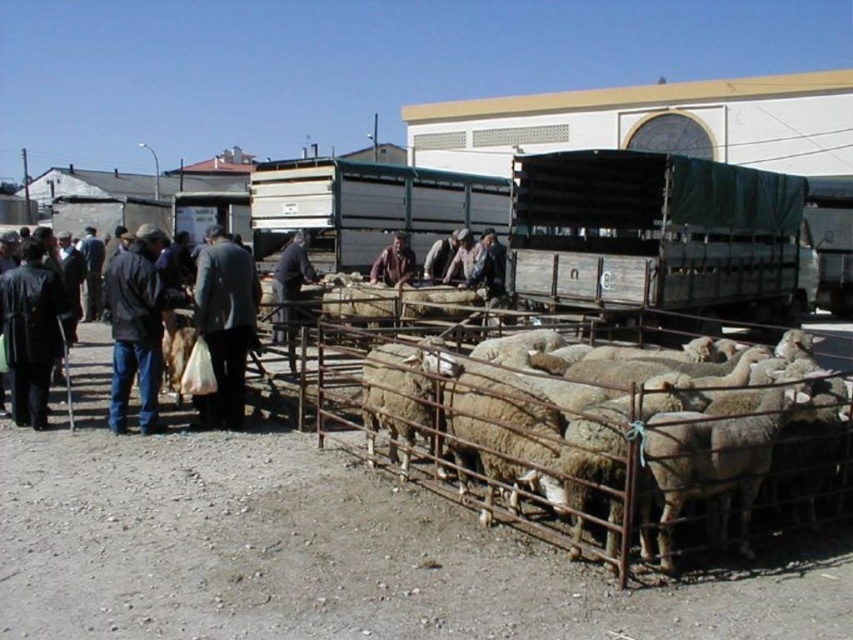
You are a photographer at the rural market scene. You need to position yourself so that both the dark blue jeans at center and the dark blue fabric at center are visible in your shot. Based on their positions, which object should be placed on the right side of your frame?

The dark blue fabric at center should be on the right side of your frame because the dark blue jeans at center is to the left of it.